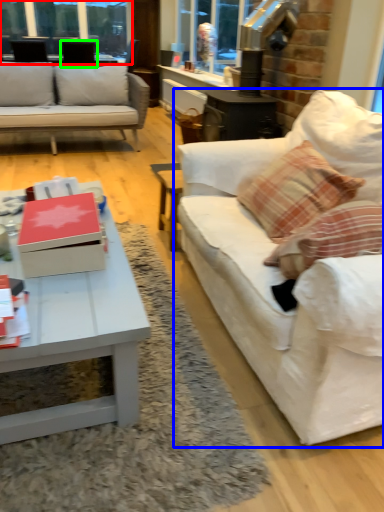
Question: Considering the real-world distances, which object is closest to window frame (highlighted by a red box)? studio couch (highlighted by a blue box) or armchair (highlighted by a green box).

Choices:
 (A) studio couch
 (B) armchair

Answer: (B)